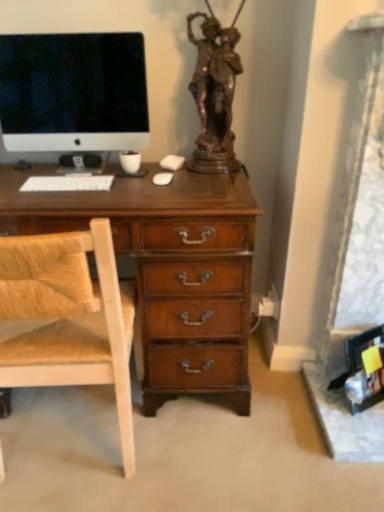
Question: Should I look upward or downward to see white matte keyboard at center?

Choices:
 (A) up
 (B) down

Answer: (A)

Question: Does bronze statue at upper center have a larger size compared to white glossy computer monitor at upper left?

Choices:
 (A) yes
 (B) no

Answer: (A)

Question: Does bronze statue at upper center have a greater width compared to white glossy computer monitor at upper left?

Choices:
 (A) yes
 (B) no

Answer: (A)

Question: Is bronze statue at upper center far from white glossy computer monitor at upper left?

Choices:
 (A) no
 (B) yes

Answer: (A)

Question: From a real-world perspective, does bronze statue at upper center stand above white glossy computer monitor at upper left?

Choices:
 (A) no
 (B) yes

Answer: (B)

Question: Are bronze statue at upper center and white glossy computer monitor at upper left making contact?

Choices:
 (A) no
 (B) yes

Answer: (A)

Question: From a real-world perspective, is bronze statue at upper center physically below white glossy computer monitor at upper left?

Choices:
 (A) no
 (B) yes

Answer: (A)

Question: Can you confirm if white matte keyboard at center is positioned to the left of bronze statue at upper center?

Choices:
 (A) no
 (B) yes

Answer: (B)

Question: Is white matte keyboard at center outside of bronze statue at upper center?

Choices:
 (A) no
 (B) yes

Answer: (B)

Question: Does white matte keyboard at center have a lesser height compared to bronze statue at upper center?

Choices:
 (A) yes
 (B) no

Answer: (A)

Question: From the image's perspective, is white matte keyboard at center under bronze statue at upper center?

Choices:
 (A) no
 (B) yes

Answer: (B)

Question: Is white matte keyboard at center oriented towards bronze statue at upper center?

Choices:
 (A) yes
 (B) no

Answer: (B)

Question: Is white matte keyboard at center closer to camera compared to bronze statue at upper center?

Choices:
 (A) yes
 (B) no

Answer: (B)

Question: From the image's perspective, is light brown wood chair at left located beneath white glossy computer monitor at upper left?

Choices:
 (A) no
 (B) yes

Answer: (B)